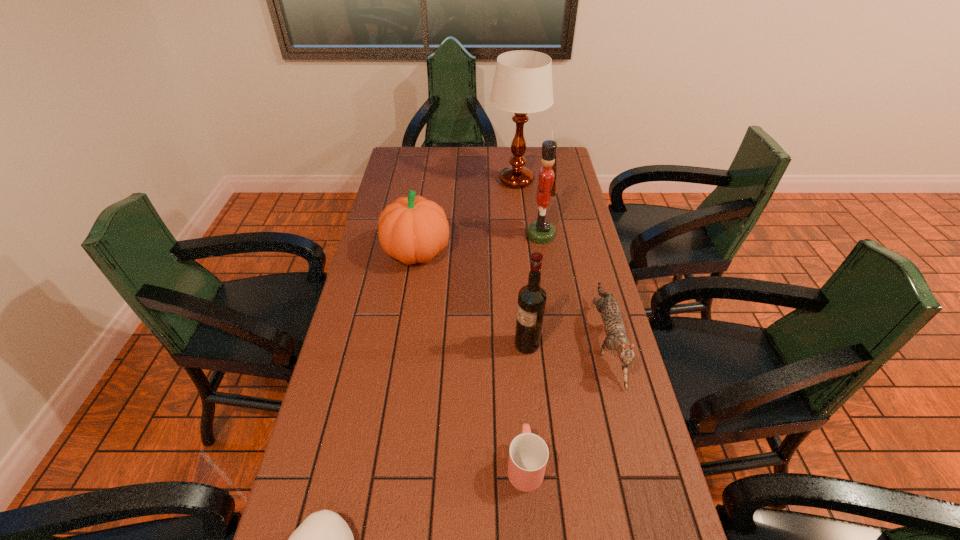
This screenshot has width=960, height=540. Find the location of `free spot between the third shortest object and the pumpkin`. free spot between the third shortest object and the pumpkin is located at coordinates (511, 296).

Locate an element on the screen. The height and width of the screenshot is (540, 960). vacant region between the cat and the nutcracker is located at coordinates (573, 288).

Find the location of `vacant space that's between the fifth tallest object and the pumpkin`. vacant space that's between the fifth tallest object and the pumpkin is located at coordinates (511, 296).

Where is `free spot between the fifth tallest object and the tallest object`? This screenshot has height=540, width=960. free spot between the fifth tallest object and the tallest object is located at coordinates (561, 261).

Find the location of a particular element. The height and width of the screenshot is (540, 960). unoccupied area between the fifth shortest object and the cat is located at coordinates (566, 343).

Where is `vacant space that's between the pumpkin and the wine bottle`? The width and height of the screenshot is (960, 540). vacant space that's between the pumpkin and the wine bottle is located at coordinates (471, 299).

I want to click on vacant space that is in between the wine bottle and the cup, so coord(526,404).

Identify the location of object that is the sixth closest to the fourth shortest object. The height and width of the screenshot is (540, 960). (324, 539).

The width and height of the screenshot is (960, 540). I want to click on object that is the fifth closest to the fifth tallest object, so click(522, 84).